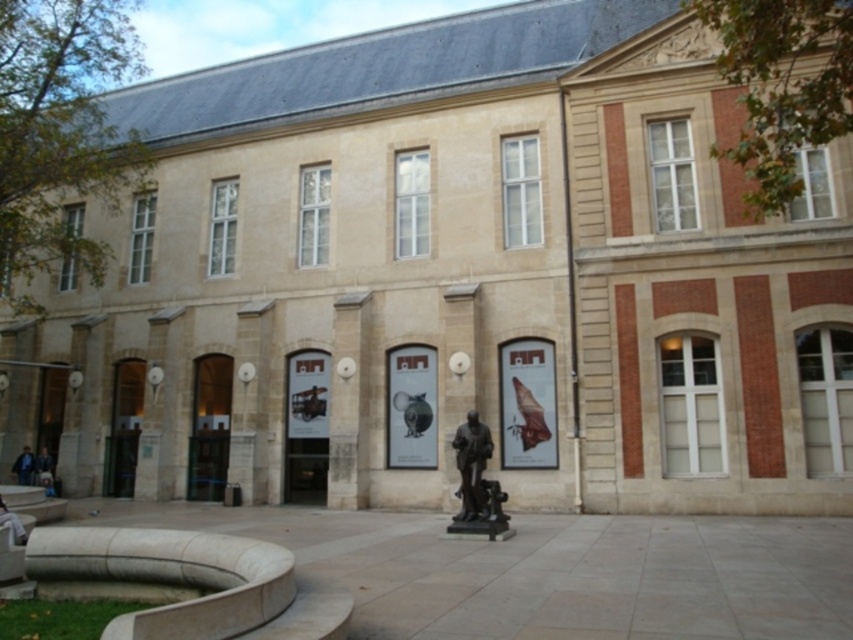
Who is positioned more to the left, light blue jeans at lower left or dark blue fabric jacket at lower left?

dark blue fabric jacket at lower left is more to the left.

Does point (6, 508) lie behind point (27, 484)?

No, it is not.

Identify the location of light blue jeans at lower left. The width and height of the screenshot is (853, 640). (12, 524).

Describe the element at coordinates (476, 476) in the screenshot. I see `bronze statue at center` at that location.

Is bronze statue at center above blue denim jacket at lower left?

Yes, bronze statue at center is above blue denim jacket at lower left.

You are a GUI agent. You are given a task and a screenshot of the screen. Output one action in this format:
    pyautogui.click(x=<x>, y=<y>)
    Task: Click on the bronze statue at center
    
    Given the screenshot: What is the action you would take?
    pyautogui.click(x=476, y=476)

Between dark blue fabric jacket at lower left and blue denim jacket at lower left, which one has less height?

blue denim jacket at lower left

Does dark blue fabric jacket at lower left come in front of blue denim jacket at lower left?

No.

Who is more forward, (22, 464) or (38, 465)?

Positioned in front is point (22, 464).

I want to click on dark blue fabric jacket at lower left, so click(x=22, y=467).